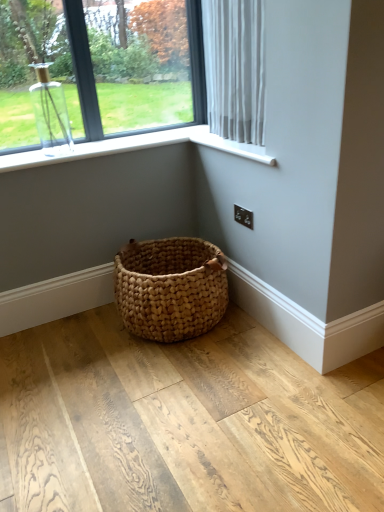
The image size is (384, 512). Describe the element at coordinates (229, 145) in the screenshot. I see `white plastic window sill at upper right` at that location.

From the picture: What is the approximate width of clear glass vase at upper left?

clear glass vase at upper left is 2.29 inches in width.

You are a GUI agent. You are given a task and a screenshot of the screen. Output one action in this format:
    pyautogui.click(x=<x>, y=<y>)
    Task: Click on the clear glass vase at upper left
    The image size is (384, 512).
    Given the screenshot: What is the action you would take?
    pyautogui.click(x=99, y=68)

The image size is (384, 512). I want to click on white plastic window sill at upper right, so click(229, 145).

This screenshot has width=384, height=512. I want to click on curtain on the right side of clear glass vase at upper left, so click(235, 68).

Could clear glass vase at upper left be considered to be inside white sheer curtain at upper right?

No, clear glass vase at upper left is not a part of white sheer curtain at upper right.

How many degrees apart are the facing directions of white sheer curtain at upper right and clear glass vase at upper left?

The facing directions of white sheer curtain at upper right and clear glass vase at upper left are 90.4 degrees apart.

Looking at this image, is white sheer curtain at upper right taller or shorter than clear glass vase at upper left?

Clearly, white sheer curtain at upper right is taller compared to clear glass vase at upper left.

Is white sheer curtain at upper right a part of clear glass vase at upper left?

That's incorrect, white sheer curtain at upper right is not inside clear glass vase at upper left.

From a real-world perspective, who is located lower, clear glass vase at upper left or white sheer curtain at upper right?

From a 3D spatial view, white sheer curtain at upper right is below.

Between clear glass vase at upper left and white sheer curtain at upper right, which one has smaller width?

clear glass vase at upper left.

Is white plastic window sill at upper right next to clear glass vase at upper left and touching it?

No, white plastic window sill at upper right is not making contact with clear glass vase at upper left.

You are a GUI agent. You are given a task and a screenshot of the screen. Output one action in this format:
    pyautogui.click(x=<x>, y=<y>)
    Task: Click on the window above the white plastic window sill at upper right (from a real-world perspective)
    The image size is (384, 512).
    Given the screenshot: What is the action you would take?
    pyautogui.click(x=99, y=68)

Which of these two, white plastic window sill at upper right or clear glass vase at upper left, is wider?

Wider between the two is white plastic window sill at upper right.

Which object is more forward, white plastic window sill at upper right or clear glass vase at upper left?

white plastic window sill at upper right is closer to the camera.

Is white plastic window sill at upper right surrounded by clear glass vase at upper left?

No, white plastic window sill at upper right is not surrounded by clear glass vase at upper left.

What's the angular difference between clear glass vase at upper left and white plastic window sill at upper right's facing directions?

clear glass vase at upper left and white plastic window sill at upper right are facing 90 degrees away from each other.

Can you confirm if clear glass vase at upper left is shorter than white plastic window sill at upper right?

No.

Which of these two, white plastic window sill at upper right or white sheer curtain at upper right, is smaller?

With smaller size is white plastic window sill at upper right.

Between point (210, 145) and point (255, 90), which one is positioned in front?

Point (255, 90)

Based on the photo, would you say white plastic window sill at upper right is inside or outside white sheer curtain at upper right?

The correct answer is: inside.

From the image's perspective, is white plastic window sill at upper right on white sheer curtain at upper right?

No, from the image's perspective, white plastic window sill at upper right is not above white sheer curtain at upper right.

How different are the orientations of white sheer curtain at upper right and white plastic window sill at upper right in degrees?

0.425 degrees.

From their relative heights in the image, would you say white sheer curtain at upper right is taller or shorter than white plastic window sill at upper right?

In the image, white sheer curtain at upper right appears to be taller than white plastic window sill at upper right.

Based on their positions, is white sheer curtain at upper right located to the left or right of white plastic window sill at upper right?

Based on their positions, white sheer curtain at upper right is located to the left of white plastic window sill at upper right.

Can you see white sheer curtain at upper right touching white plastic window sill at upper right?

There is a gap between white sheer curtain at upper right and white plastic window sill at upper right.

Where is `curtain below the clear glass vase at upper left (from a real-world perspective)`? curtain below the clear glass vase at upper left (from a real-world perspective) is located at coordinates (235, 68).

Find the location of a particular element. curtain that appears on the right of clear glass vase at upper left is located at coordinates (235, 68).

Considering their positions, is white sheer curtain at upper right positioned further to white plastic window sill at upper right than clear glass vase at upper left?

Among the two, clear glass vase at upper left is located further to white plastic window sill at upper right.

Which object lies further to the anchor point white sheer curtain at upper right, white plastic window sill at upper right or clear glass vase at upper left?

Among the two, clear glass vase at upper left is located further to white sheer curtain at upper right.

When comparing their distances from white plastic window sill at upper right, does clear glass vase at upper left or white sheer curtain at upper right seem closer?

Based on the image, white sheer curtain at upper right appears to be nearer to white plastic window sill at upper right.

Estimate the real-world distances between objects in this image. Which object is further from clear glass vase at upper left, white sheer curtain at upper right or white plastic window sill at upper right?

white plastic window sill at upper right is further to clear glass vase at upper left.

Based on their spatial positions, is white plastic window sill at upper right or white sheer curtain at upper right further from clear glass vase at upper left?

Among the two, white plastic window sill at upper right is located further to clear glass vase at upper left.

Estimate the real-world distances between objects in this image. Which object is further from white sheer curtain at upper right, clear glass vase at upper left or white plastic window sill at upper right?

clear glass vase at upper left lies further to white sheer curtain at upper right than the other object.

In order to click on curtain located between clear glass vase at upper left and white plastic window sill at upper right in the left-right direction in this screenshot , I will do `click(235, 68)`.